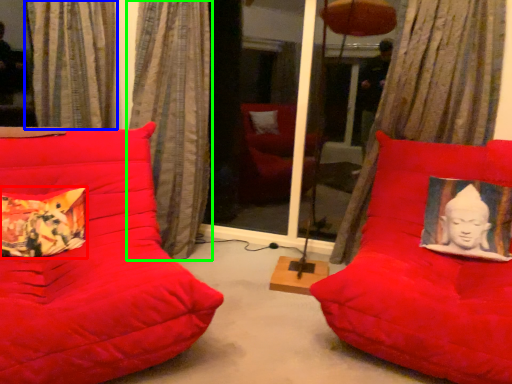
Question: Which object is the farthest from pillow (highlighted by a red box)? Choose among these: curtain (highlighted by a blue box) or curtain (highlighted by a green box).

Choices:
 (A) curtain
 (B) curtain

Answer: (A)